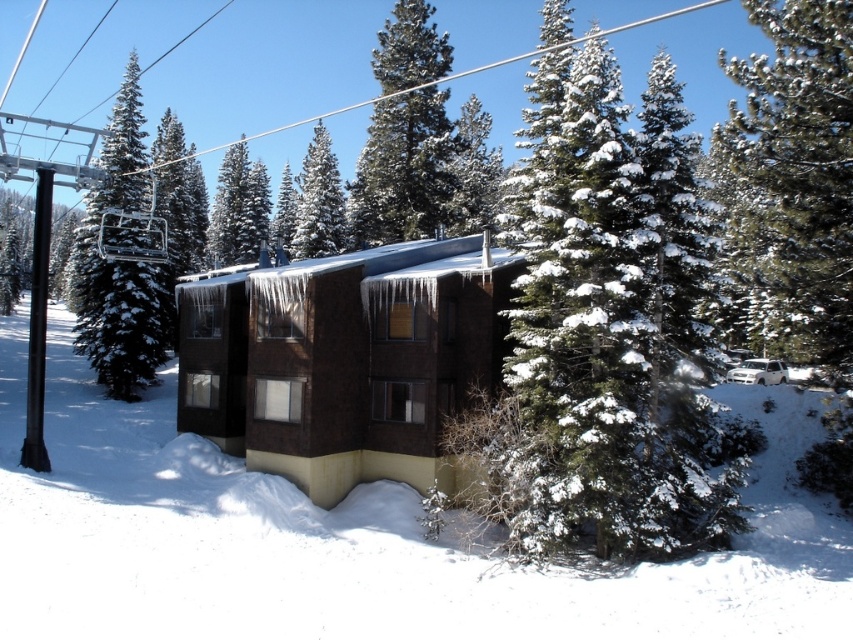
From the picture: Who is more forward, (320, 420) or (322, 227)?

Point (320, 420)

The width and height of the screenshot is (853, 640). What do you see at coordinates (344, 360) in the screenshot? I see `brown matte building at center` at bounding box center [344, 360].

The height and width of the screenshot is (640, 853). I want to click on brown matte building at center, so click(344, 360).

Does snow-covered pine at right appear on the right side of snow-covered pine tree at center?

Indeed, snow-covered pine at right is positioned on the right side of snow-covered pine tree at center.

Between point (755, 252) and point (323, 230), which one is positioned in front?

Point (755, 252)

I want to click on snow-covered pine at right, so click(793, 179).

Is point (357, 237) closer to camera compared to point (282, 186)?

Yes, it is in front of point (282, 186).

Consider the image. Can you confirm if snow-covered pine at center is positioned to the left of green matte tree at center?

Incorrect, snow-covered pine at center is not on the left side of green matte tree at center.

I want to click on snow-covered pine at center, so click(418, 141).

Locate an element on the screen. Image resolution: width=853 pixels, height=640 pixels. snow-covered pine at center is located at coordinates (418, 141).